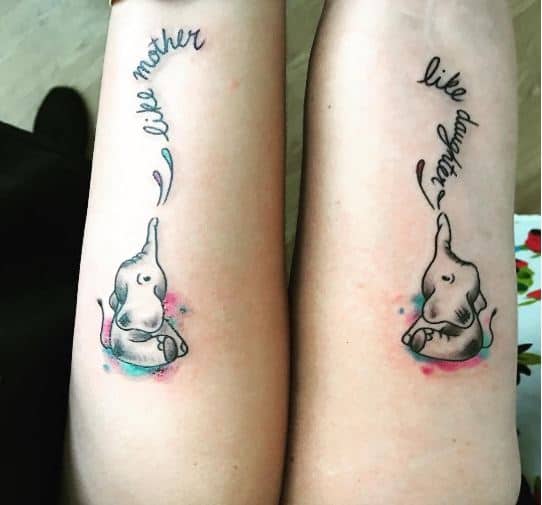
Locate an element on the screen. This screenshot has width=542, height=505. floor is located at coordinates (55, 42).